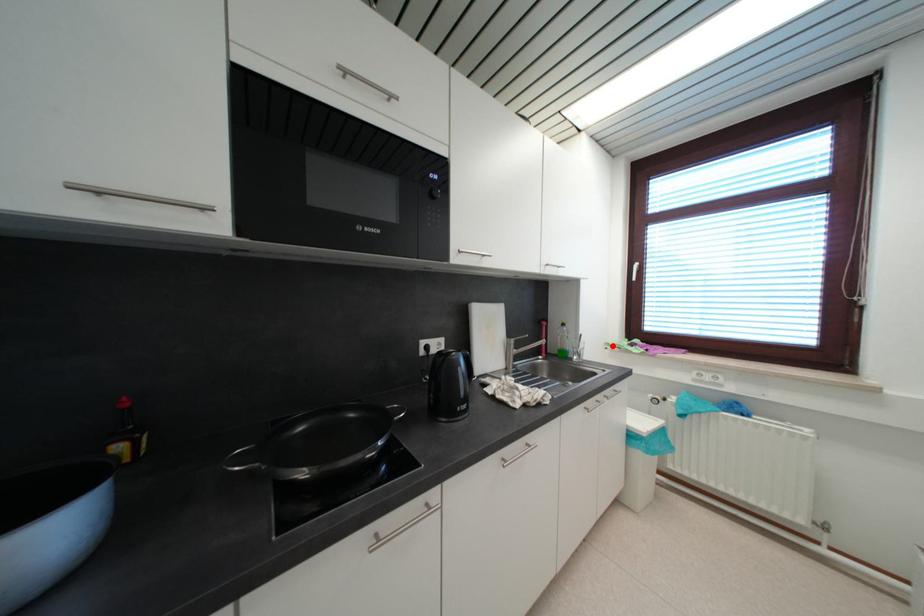
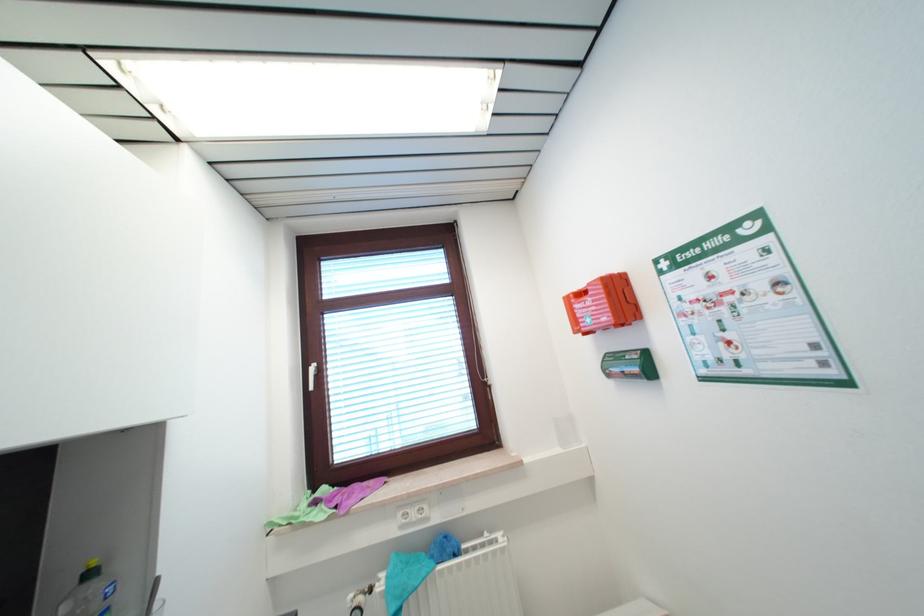
Find the pixel in the second image that matches the highlighted location in the first image.

(274, 525)